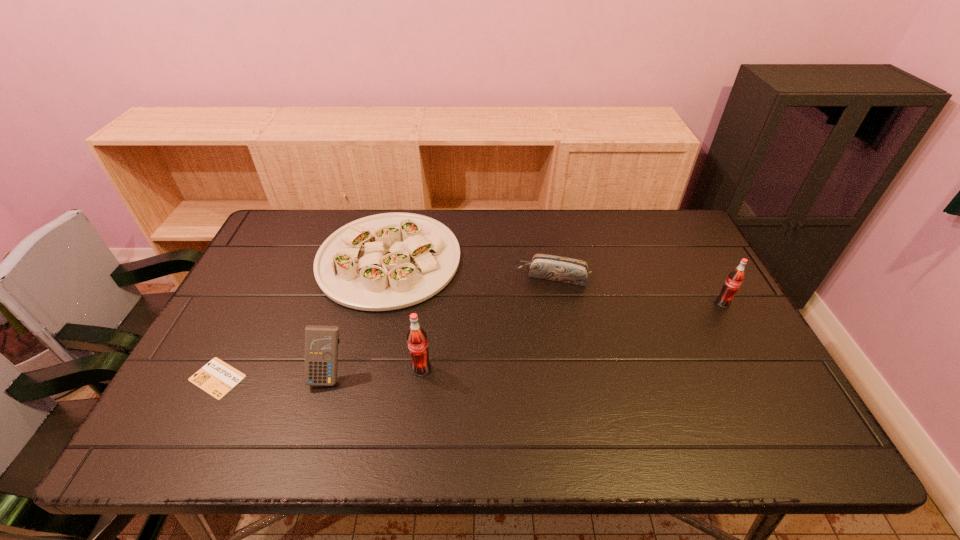
I want to click on vacant spot for a new pop_(soda) to ensure equal spacing, so click(583, 334).